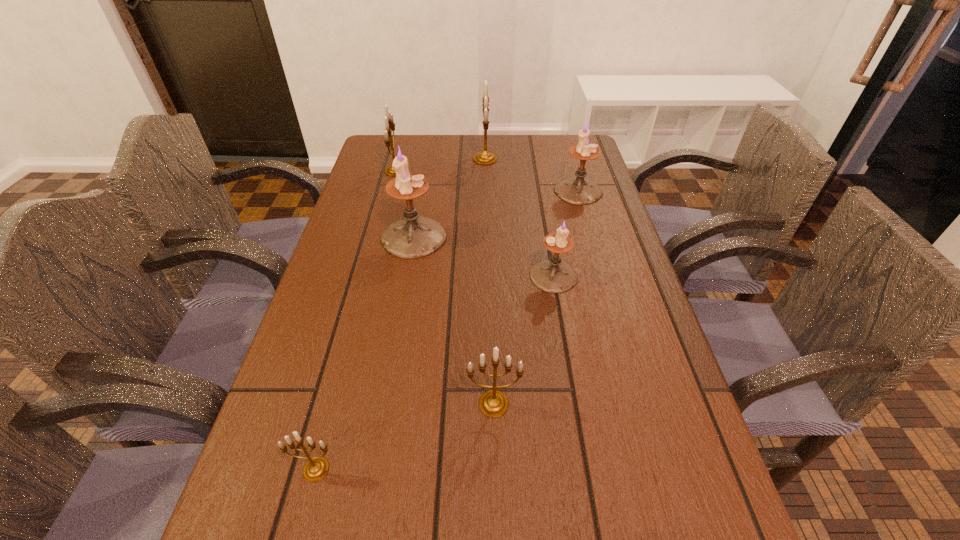
Identify the location of the shortest object. Image resolution: width=960 pixels, height=540 pixels. (316, 468).

Identify the location of vacant space located on the right of the fourth nearest object. This screenshot has height=540, width=960. (602, 237).

The height and width of the screenshot is (540, 960). In order to click on vacant space located on the left of the biggest gold candelabrum in this screenshot , I will do `click(408, 159)`.

Find the location of `vacant region located on the front of the third smallest gold candelabrum`. vacant region located on the front of the third smallest gold candelabrum is located at coordinates (372, 263).

Find the location of a particular element. The height and width of the screenshot is (540, 960). vacant region located on the front of the farthest purple candle holder is located at coordinates (596, 254).

At what (x,y) coordinates should I click in order to perform the action: click on vacant space located on the back of the nearest purple candle holder. Please return your answer as a coordinate pair (x, y). This screenshot has width=960, height=540. Looking at the image, I should click on (538, 186).

At what (x,y) coordinates should I click in order to perform the action: click on free location located 0.290m on the back of the second nearest candelabrum. Please return your answer as a coordinate pair (x, y). The width and height of the screenshot is (960, 540). Looking at the image, I should click on (491, 281).

I want to click on vacant space located 0.110m on the right of the shortest candelabrum, so click(x=406, y=469).

Where is `object at the far left corner`? object at the far left corner is located at coordinates pyautogui.click(x=389, y=122).

You are a GUI agent. You are given a task and a screenshot of the screen. Output one action in this format:
    pyautogui.click(x=<x>, y=<y>)
    Task: Click on the free space at the far edge of the desktop
    The image size is (960, 540).
    Given the screenshot: What is the action you would take?
    pyautogui.click(x=541, y=170)